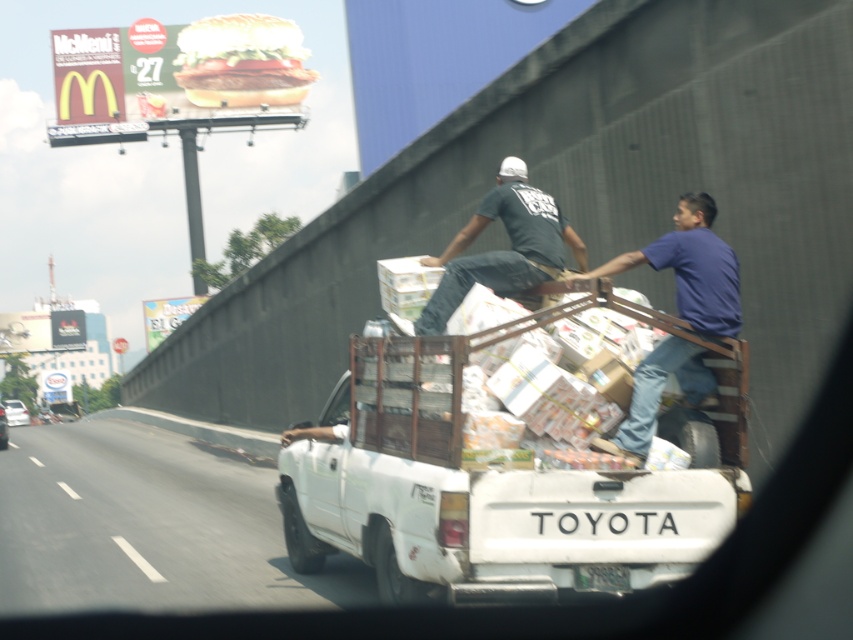
Does point (596, 488) lie in front of point (109, 552)?

Yes, it is.

Is white matte truck at center to the left of white plastic truck at lower left from the viewer's perspective?

In fact, white matte truck at center is to the right of white plastic truck at lower left.

Which is behind, point (332, 506) or point (161, 474)?

Point (161, 474)

Identify the location of white matte truck at center. (497, 483).

Is point (569, 278) closer to viewer compared to point (547, 253)?

Yes, point (569, 278) is in front of point (547, 253).

Measure the distance between point (711,305) and camera.

The distance of point (711,305) from camera is 22.20 feet.

Who is more distant from viewer, (x=659, y=387) or (x=520, y=214)?

Positioned behind is point (x=520, y=214).

The height and width of the screenshot is (640, 853). Find the location of `blue cotton shirt at upper right`. blue cotton shirt at upper right is located at coordinates (691, 268).

Is white matte truck at center thinner than black cotton shirt at upper center?

Incorrect, white matte truck at center's width is not less than black cotton shirt at upper center's.

Between white matte truck at center and black cotton shirt at upper center, which one has more height?

white matte truck at center

Between point (535, 404) and point (461, 232), which one is positioned behind?

The point (461, 232) is behind.

You are a GUI agent. You are given a task and a screenshot of the screen. Output one action in this format:
    pyautogui.click(x=<x>, y=<y>)
    Task: Click on the white matte truck at center
    
    Given the screenshot: What is the action you would take?
    pyautogui.click(x=497, y=483)